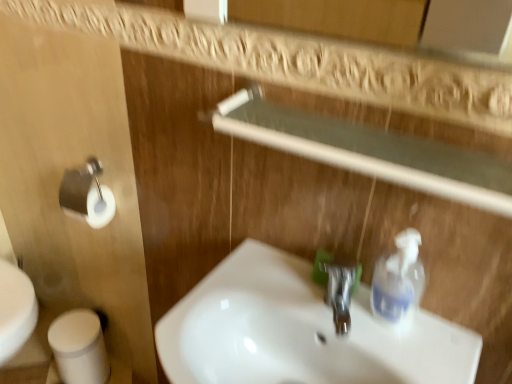
At what (x,y) coordinates should I click in order to perform the action: click on blank area beneath transparent glass balustrade at upper center (from a real-world perspective). Please return your answer as a coordinate pair (x, y). This screenshot has height=384, width=512. Looking at the image, I should click on (310, 296).